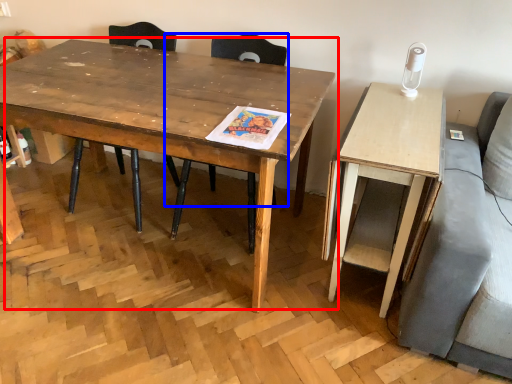
Question: Which object is closer to the camera taking this photo, coffee table (highlighted by a red box) or chair (highlighted by a blue box)?

Choices:
 (A) coffee table
 (B) chair

Answer: (A)